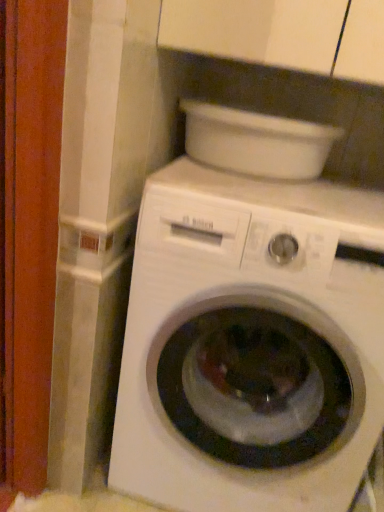
This screenshot has height=512, width=384. I want to click on empty space that is ontop of white glossy washing machine at center (from a real-world perspective), so click(275, 184).